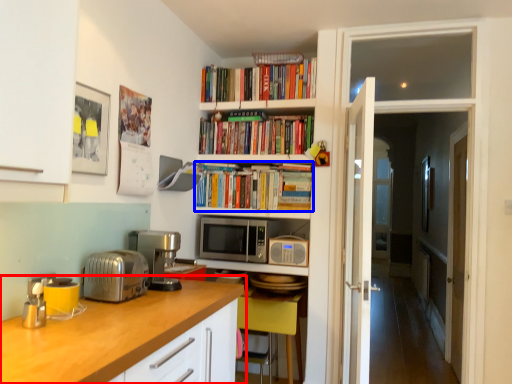
Question: Which object is closer to the camera taking this photo, countertop (highlighted by a red box) or book (highlighted by a blue box)?

Choices:
 (A) countertop
 (B) book

Answer: (A)